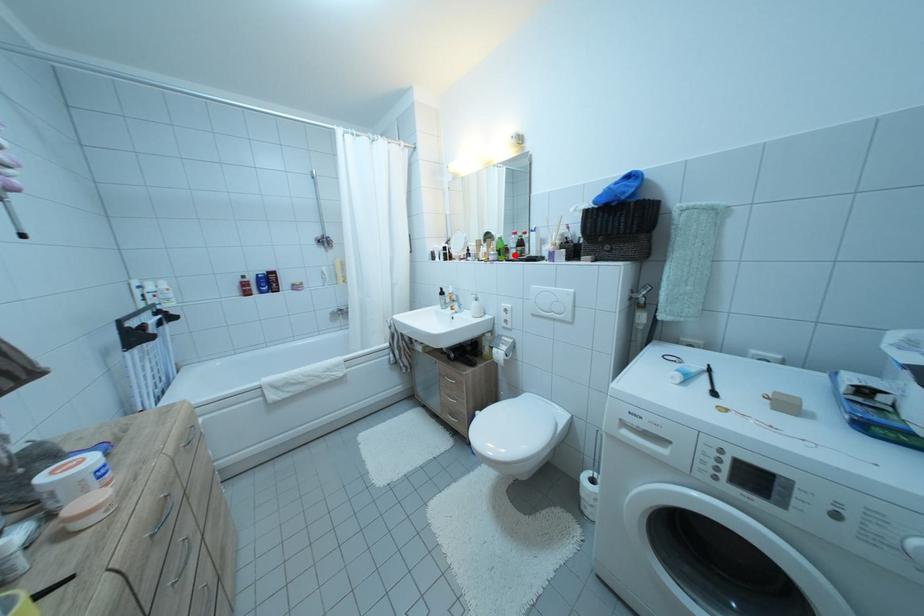
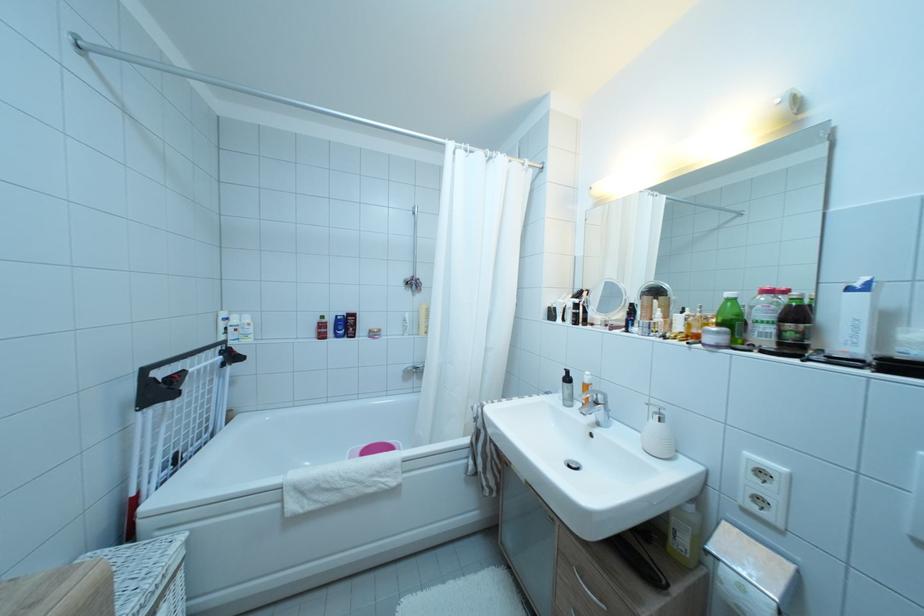
The point at the highlighted location is marked in the first image. Where is the corresponding point in the second image?

(754, 330)